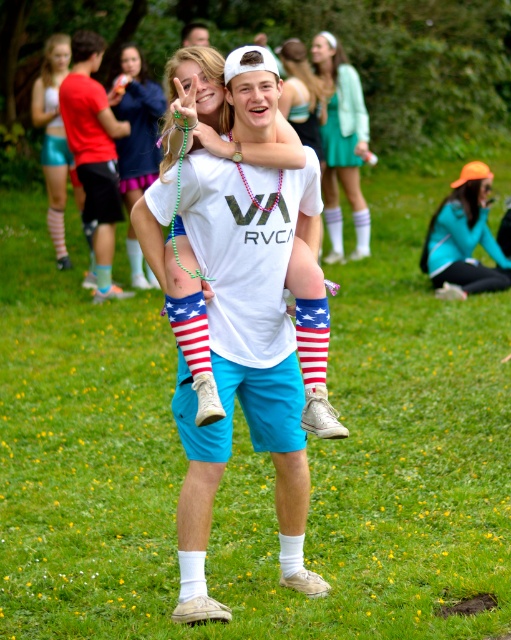
Which is more to the right, white cotton t-shirt at center or matte white shirt at center?

Positioned to the right is white cotton t-shirt at center.

Can you confirm if white cotton t-shirt at center is positioned to the left of matte white shirt at center?

No, white cotton t-shirt at center is not to the left of matte white shirt at center.

Is point (260, 289) closer to camera compared to point (122, 60)?

Yes.

Identify the location of white cotton t-shirt at center. The height and width of the screenshot is (640, 511). (244, 355).

Is white cotton t-shirt at center to the right of orange fabric hat at upper right from the viewer's perspective?

Incorrect, white cotton t-shirt at center is not on the right side of orange fabric hat at upper right.

Can you confirm if white cotton t-shirt at center is shorter than orange fabric hat at upper right?

Incorrect, white cotton t-shirt at center's height does not fall short of orange fabric hat at upper right's.

This screenshot has height=640, width=511. What do you see at coordinates (244, 355) in the screenshot?
I see `white cotton t-shirt at center` at bounding box center [244, 355].

You are a GUI agent. You are given a task and a screenshot of the screen. Output one action in this format:
    pyautogui.click(x=<x>, y=<y>)
    Task: Click on the white cotton t-shirt at center
    Image resolution: width=511 pixels, height=640 pixels.
    Given the screenshot: What is the action you would take?
    pyautogui.click(x=244, y=355)

Is orange fabric hat at upper right behind shiny teal shorts at upper left?

No.

Is orange fabric hat at upper right thinner than shiny teal shorts at upper left?

No.

The width and height of the screenshot is (511, 640). I want to click on orange fabric hat at upper right, so click(463, 237).